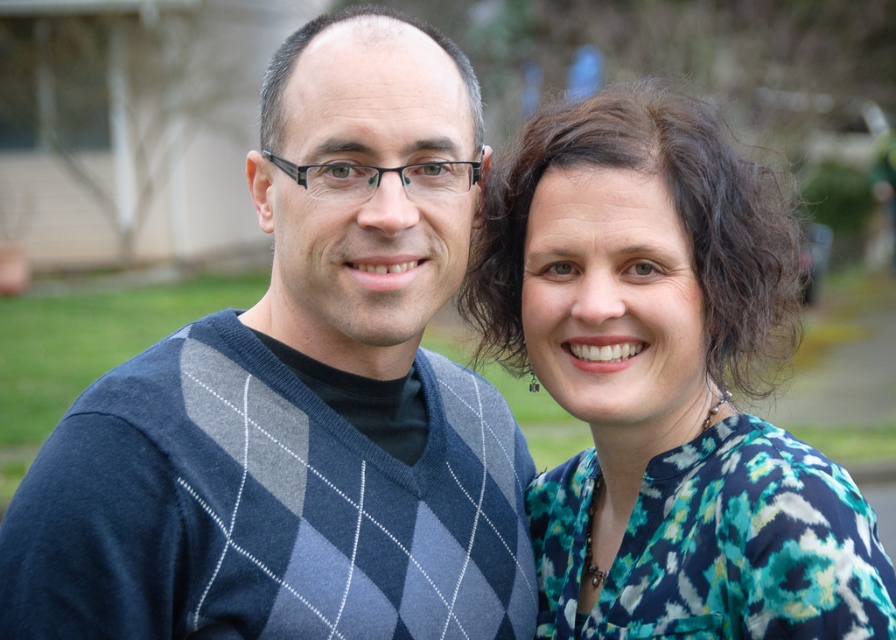
Question: Can you confirm if argyle sweater at center is positioned to the left of floral print blouse at right?

Choices:
 (A) no
 (B) yes

Answer: (B)

Question: Which point is closer to the camera taking this photo?

Choices:
 (A) (747, 419)
 (B) (322, 29)

Answer: (B)

Question: Is argyle sweater at center bigger than floral print blouse at right?

Choices:
 (A) no
 (B) yes

Answer: (B)

Question: Among these objects, which one is nearest to the camera?

Choices:
 (A) floral print blouse at right
 (B) argyle sweater at center

Answer: (B)

Question: Does argyle sweater at center have a smaller size compared to floral print blouse at right?

Choices:
 (A) yes
 (B) no

Answer: (B)

Question: Which object appears farthest from the camera in this image?

Choices:
 (A) argyle sweater at center
 (B) floral print blouse at right

Answer: (B)